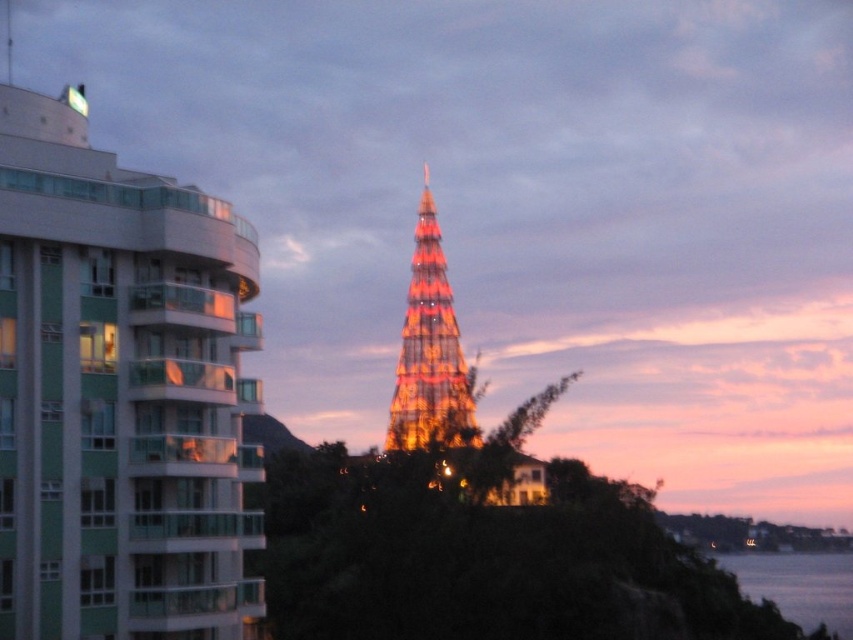
Question: In this image, where is white glossy building at left located relative to illuminated glass eiffel tower at center?

Choices:
 (A) left
 (B) right

Answer: (A)

Question: Which point appears closest to the camera in this image?

Choices:
 (A) (129, 381)
 (B) (403, 435)

Answer: (A)

Question: Estimate the real-world distances between objects in this image. Which object is closer to the illuminated glass eiffel tower at center?

Choices:
 (A) white glossy building at left
 (B) transparent water at lower right

Answer: (B)

Question: Which point is closer to the camera taking this photo?

Choices:
 (A) (6, 428)
 (B) (827, 592)

Answer: (A)

Question: Can you confirm if white glossy building at left is positioned to the left of illuminated glass eiffel tower at center?

Choices:
 (A) yes
 (B) no

Answer: (A)

Question: Is white glossy building at left to the left of transparent water at lower right from the viewer's perspective?

Choices:
 (A) no
 (B) yes

Answer: (B)